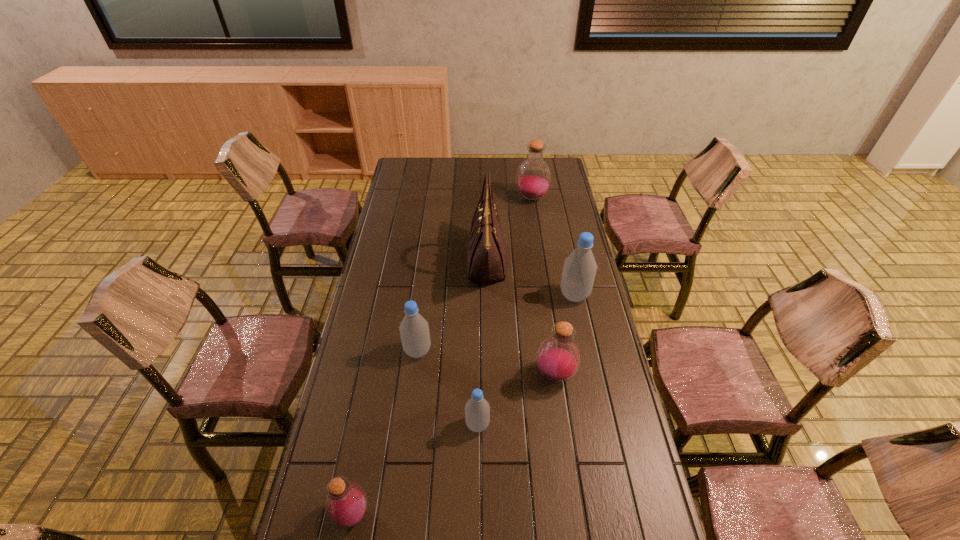
Where is `free space located 0.090m on the right of the leftmost bottle`? The width and height of the screenshot is (960, 540). free space located 0.090m on the right of the leftmost bottle is located at coordinates (406, 514).

The height and width of the screenshot is (540, 960). In order to click on object positioned at the left edge in this screenshot , I will do `click(346, 503)`.

Locate an element on the screen. Image resolution: width=960 pixels, height=540 pixels. vacant space at the left edge of the desktop is located at coordinates (372, 286).

This screenshot has height=540, width=960. In order to click on vacant space at the right edge in this screenshot , I will do `click(630, 443)`.

At what (x,y) coordinates should I click in order to perform the action: click on unoccupied position between the second nearest bottle and the second smallest purple bottle. Please return your answer as a coordinate pair (x, y). Looking at the image, I should click on (516, 400).

Identify the location of free space that is in between the handbag and the fifth farthest bottle. The height and width of the screenshot is (540, 960). (483, 343).

Identify the location of free area in between the tallest object and the second nearest bottle. (483, 343).

This screenshot has width=960, height=540. In order to click on free area in between the handbag and the second smallest gray bottle in this screenshot , I will do `click(452, 306)`.

You are a GUI agent. You are given a task and a screenshot of the screen. Output one action in this format:
    pyautogui.click(x=<x>, y=<y>)
    Task: Click on the vacant area between the second farthest bottle and the tallest object
    Image resolution: width=960 pixels, height=540 pixels.
    Given the screenshot: What is the action you would take?
    pyautogui.click(x=531, y=279)

Where is `object that stands as the sixth closest to the rightmost gray bottle`? object that stands as the sixth closest to the rightmost gray bottle is located at coordinates (346, 503).